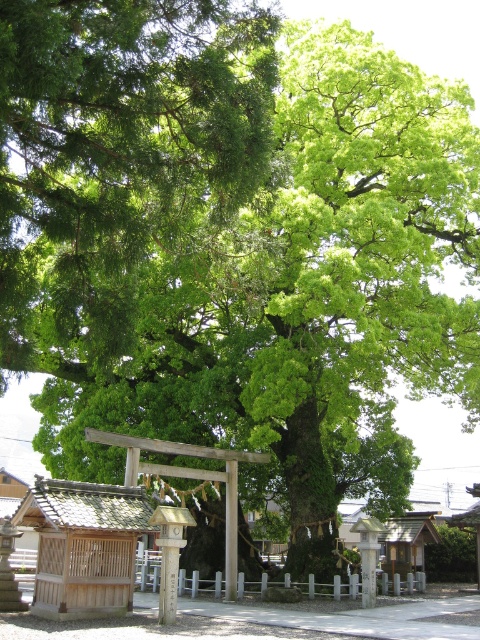
Question: Does green leafy tree at center have a lesser width compared to wooden post at center?

Choices:
 (A) yes
 (B) no

Answer: (B)

Question: Estimate the real-world distances between objects in this image. Which object is farther from the wooden shrine at center?

Choices:
 (A) matte wood post at center
 (B) wooden shrine at lower left
 (C) green leafy tree at center

Answer: (C)

Question: Is green leafy tree at center wider than wooden shrine at center?

Choices:
 (A) no
 (B) yes

Answer: (B)

Question: Where is wooden shrine at lower left located in relation to wooden post at center in the image?

Choices:
 (A) above
 (B) below

Answer: (A)

Question: Which object appears farthest from the camera in this image?

Choices:
 (A) wooden post at center
 (B) matte wood post at center
 (C) wooden shrine at center

Answer: (C)

Question: Estimate the real-world distances between objects in this image. Which object is closer to the wooden post at center?

Choices:
 (A) green leafy tree at center
 (B) wooden shrine at center
 (C) wooden shrine at lower left

Answer: (C)